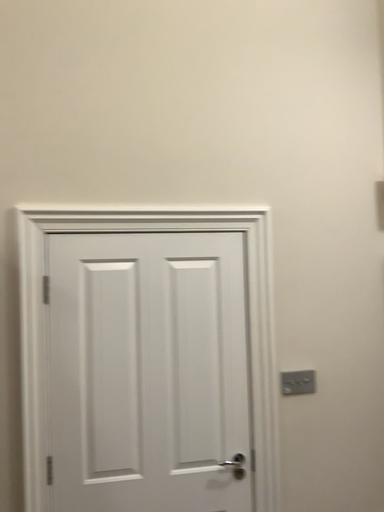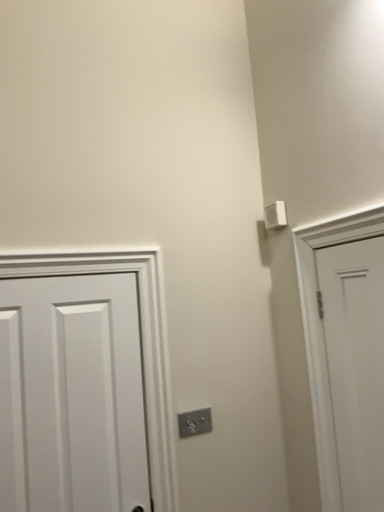
Question: Which way did the camera rotate in the video?

Choices:
 (A) rotated right
 (B) rotated left

Answer: (A)